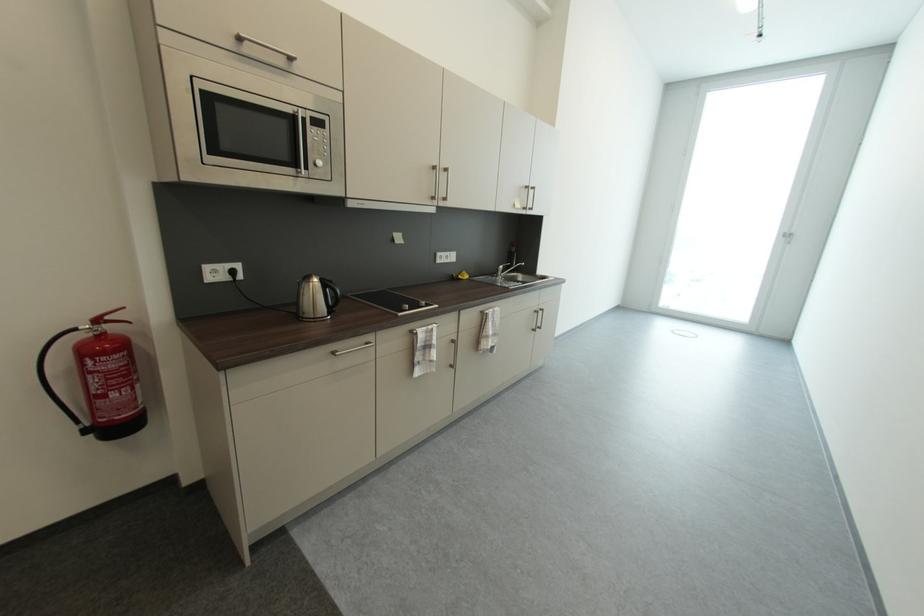
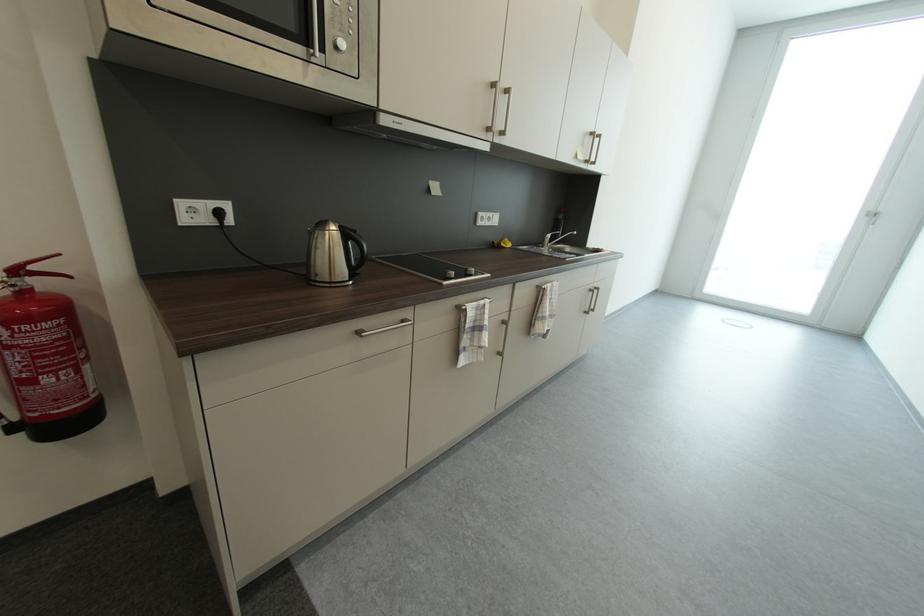
The point at (504, 272) is marked in the first image. Where is the corresponding point in the second image?

(550, 241)